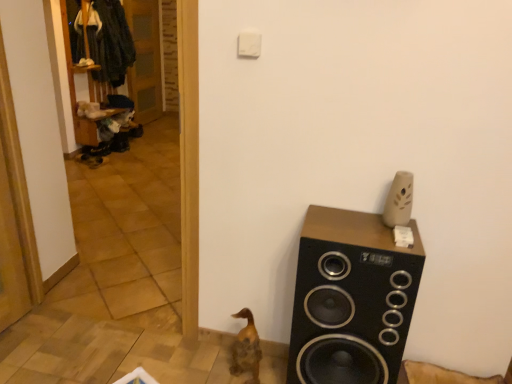
Question: Is black matte speaker at right to the left of brown wooden duck at lower center from the viewer's perspective?

Choices:
 (A) no
 (B) yes

Answer: (A)

Question: From the image's perspective, would you say black matte speaker at right is shown under brown wooden duck at lower center?

Choices:
 (A) no
 (B) yes

Answer: (A)

Question: Is black matte speaker at right oriented towards brown wooden duck at lower center?

Choices:
 (A) no
 (B) yes

Answer: (A)

Question: Does black matte speaker at right have a lesser height compared to brown wooden duck at lower center?

Choices:
 (A) no
 (B) yes

Answer: (A)

Question: Does black matte speaker at right come behind brown wooden duck at lower center?

Choices:
 (A) no
 (B) yes

Answer: (A)

Question: From the image's perspective, relative to wooden at left, is brown wooden duck at lower center above or below?

Choices:
 (A) above
 (B) below

Answer: (B)

Question: Which is correct: brown wooden duck at lower center is inside wooden at left, or outside of it?

Choices:
 (A) inside
 (B) outside

Answer: (B)

Question: From a real-world perspective, is brown wooden duck at lower center positioned above or below wooden at left?

Choices:
 (A) above
 (B) below

Answer: (B)

Question: In terms of width, does brown wooden duck at lower center look wider or thinner when compared to wooden at left?

Choices:
 (A) thin
 (B) wide

Answer: (B)

Question: Does point (344, 248) appear closer or farther from the camera than point (257, 332)?

Choices:
 (A) farther
 (B) closer

Answer: (B)

Question: Is black matte speaker at right wider or thinner than brown wooden duck at lower center?

Choices:
 (A) thin
 (B) wide

Answer: (B)

Question: Is black matte speaker at right taller or shorter than brown wooden duck at lower center?

Choices:
 (A) short
 (B) tall

Answer: (B)

Question: Considering their positions, is black matte speaker at right located in front of or behind brown wooden duck at lower center?

Choices:
 (A) front
 (B) behind

Answer: (A)

Question: In the image, is brown wooden duck at lower center positioned in front of or behind black matte speaker at right?

Choices:
 (A) behind
 (B) front

Answer: (A)

Question: Is brown wooden duck at lower center situated inside black matte speaker at right or outside?

Choices:
 (A) inside
 (B) outside

Answer: (B)